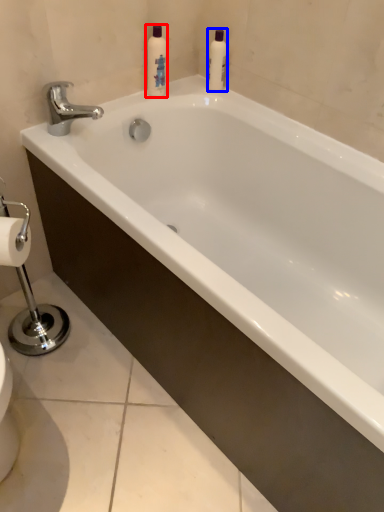
Question: Which object is further to the camera taking this photo, cleaning product (highlighted by a red box) or cleaning product (highlighted by a blue box)?

Choices:
 (A) cleaning product
 (B) cleaning product

Answer: (B)